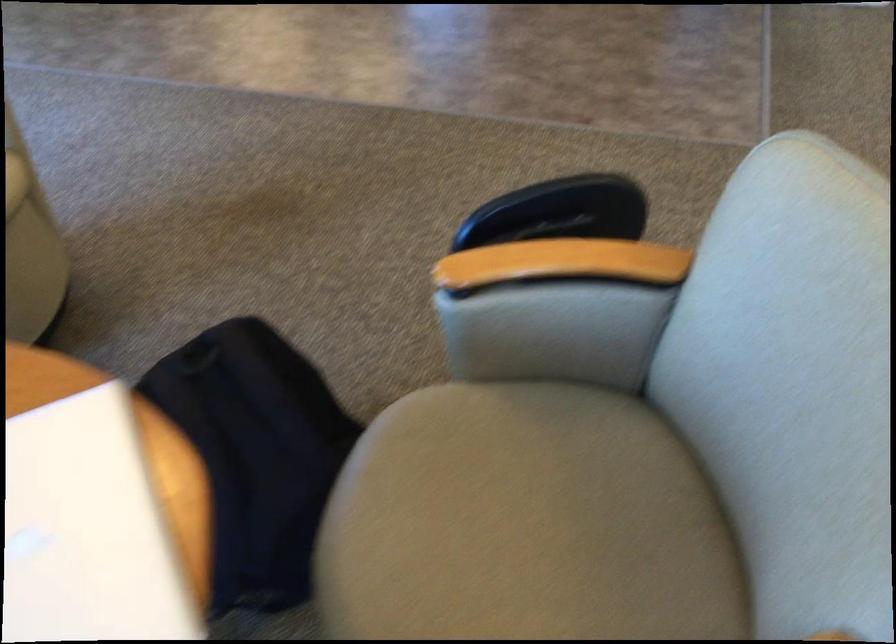
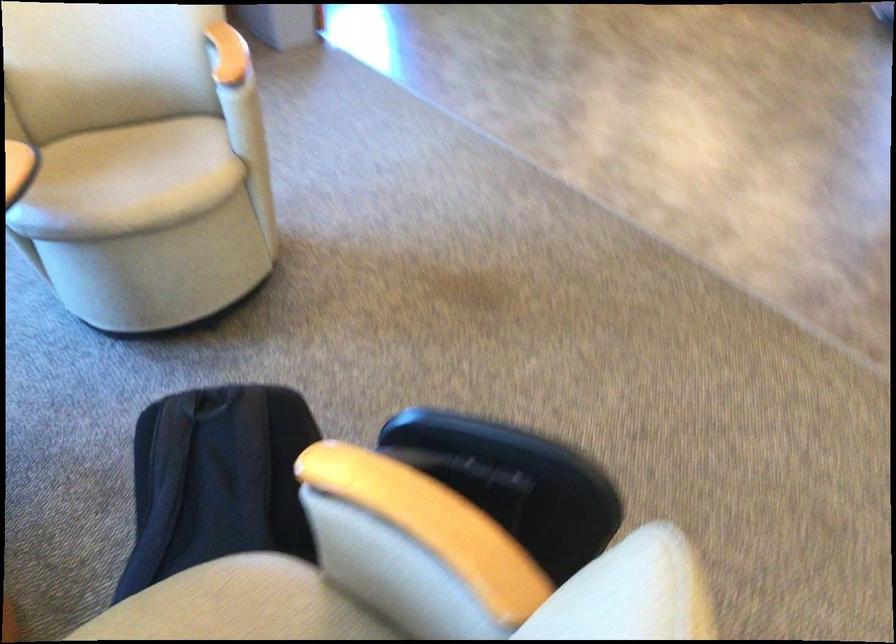
In the second image, find the point that corresponds to the point at 442,430 in the first image.

(237, 605)